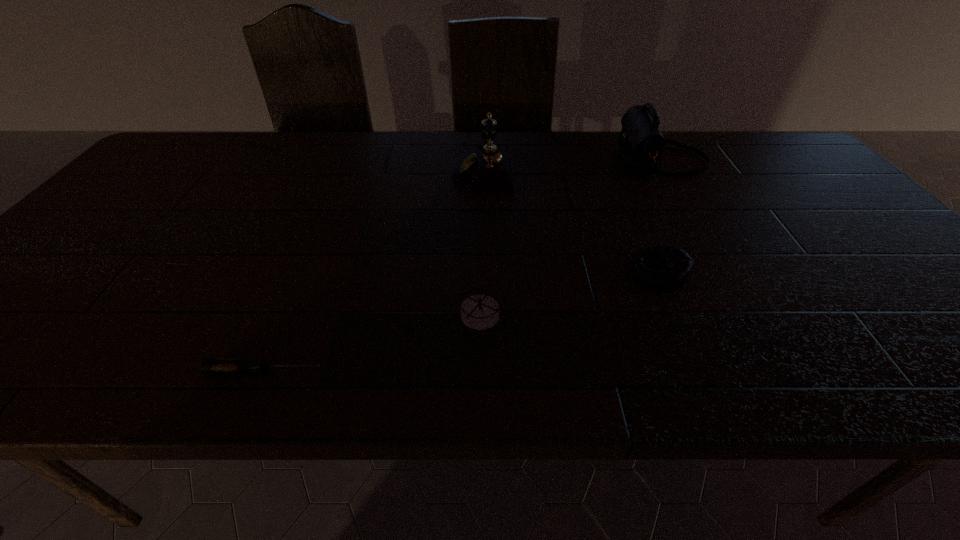
In the image, there is a desktop. Where is `free space at the far left corner`? This screenshot has width=960, height=540. free space at the far left corner is located at coordinates (196, 166).

At what (x,y) coordinates should I click in order to perform the action: click on vacant space at the far right corner of the desktop. Please return your answer as a coordinate pair (x, y). The height and width of the screenshot is (540, 960). Looking at the image, I should click on (765, 137).

The image size is (960, 540). What are the coordinates of `free spot between the telephone and the shortest object` in the screenshot? It's located at (374, 270).

The image size is (960, 540). What are the coordinates of `free space between the nearest object and the telephone` in the screenshot? It's located at click(374, 270).

At what (x,y) coordinates should I click in order to perform the action: click on free space between the compass and the telephone. Please return your answer as a coordinate pair (x, y). This screenshot has width=960, height=540. Looking at the image, I should click on (481, 241).

I want to click on vacant area that lies between the nearest object and the telephone, so click(374, 270).

In order to click on free space between the leftmost object and the telephone in this screenshot , I will do coord(374,270).

Find the location of a particular element. This screenshot has height=540, width=960. free space that is in between the third nearest object and the leftmost object is located at coordinates (461, 322).

I want to click on free space between the compass and the telephone, so pyautogui.click(x=481, y=241).

Locate an element on the screen. free point between the leftmost object and the compass is located at coordinates (372, 342).